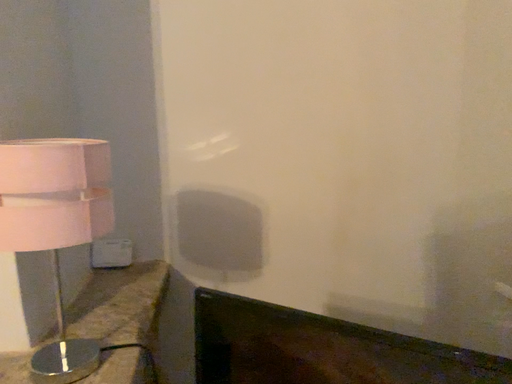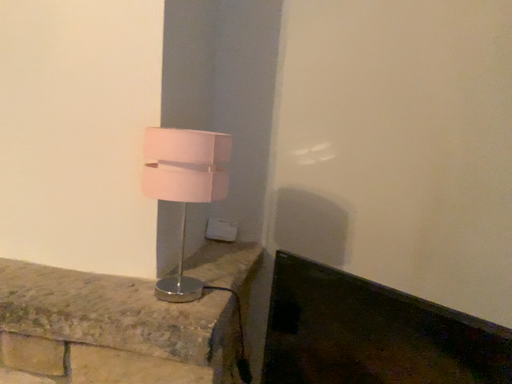
Question: Which way did the camera rotate in the video?

Choices:
 (A) rotated left
 (B) rotated right

Answer: (A)